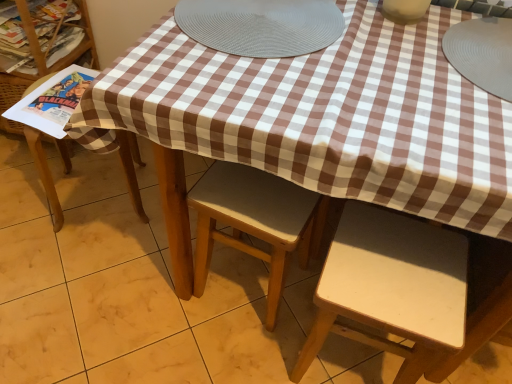
Image resolution: width=512 pixels, height=384 pixels. What do you see at coordinates (53, 101) in the screenshot?
I see `matte paper magazine at left` at bounding box center [53, 101].

In order to click on matte white vase at upper center, which is the 2th tableware from right to left in this screenshot , I will do `click(405, 10)`.

This screenshot has width=512, height=384. Describe the element at coordinates (42, 36) in the screenshot. I see `matte paper book at left` at that location.

Measure the distance between point (64, 23) and camera.

Point (64, 23) and camera are 4.95 feet apart.

This screenshot has width=512, height=384. What do you see at coordinates (402, 293) in the screenshot?
I see `white matte chair at lower right, positioned as the 3th chair in left-to-right order` at bounding box center [402, 293].

Identify the location of white matte chair at lower right, placed as the 1th chair when sorted from right to left. The height and width of the screenshot is (384, 512). (402, 293).

The width and height of the screenshot is (512, 384). Identify the location of matte paper magazine at left. (53, 101).

Is wooden chair at left, which ranks as the 1th chair in left-to-right order, to the left or to the right of gray rubber placemat at upper right, the 1th tableware viewed from the right, in the image?

Based on their positions, wooden chair at left, which ranks as the 1th chair in left-to-right order, is located to the left of gray rubber placemat at upper right, the 1th tableware viewed from the right.

Which is behind, wooden chair at left, which ranks as the 1th chair in left-to-right order, or gray rubber placemat at upper right, the second tableware positioned from the left?

wooden chair at left, which ranks as the 1th chair in left-to-right order.

From a real-world perspective, is wooden chair at left, which ranks as the third chair in right-to-left order, positioned above or below gray rubber placemat at upper right, the 1th tableware viewed from the right?

wooden chair at left, which ranks as the third chair in right-to-left order, is below gray rubber placemat at upper right, the 1th tableware viewed from the right.

Is light brown wood chair at center, which is counted as the 2th chair, starting from the right, far away from gray rubber placemat at upper right, the second tableware positioned from the left?

light brown wood chair at center, which is counted as the 2th chair, starting from the right, is actually quite close to gray rubber placemat at upper right, the second tableware positioned from the left.

Can you confirm if light brown wood chair at center, which appears as the second chair when viewed from the left, is smaller than gray rubber placemat at upper right, the second tableware positioned from the left?

Incorrect, light brown wood chair at center, which appears as the second chair when viewed from the left, is not smaller in size than gray rubber placemat at upper right, the second tableware positioned from the left.

From a real-world perspective, is light brown wood chair at center, which appears as the second chair when viewed from the left, physically located above or below gray rubber placemat at upper right, the 1th tableware viewed from the right?

light brown wood chair at center, which appears as the second chair when viewed from the left, is situated lower than gray rubber placemat at upper right, the 1th tableware viewed from the right, in the real world.

Which is in front, point (226, 202) or point (446, 43)?

Point (446, 43)

Based on the photo, which object is closer to the camera, matte paper book at left or gray textured placemat at center?

Positioned in front is gray textured placemat at center.

The height and width of the screenshot is (384, 512). I want to click on book below the gray textured placemat at center (from a real-world perspective), so click(42, 36).

Who is taller, matte paper book at left or gray textured placemat at center?

matte paper book at left.

Is point (389, 14) positioned behind point (320, 305)?

Yes.

From the picture: From the image's perspective, is matte white vase at upper center, the 1th tableware viewed from the left, on top of white matte chair at lower right, positioned as the 3th chair in left-to-right order?

Indeed, from the image's perspective, matte white vase at upper center, the 1th tableware viewed from the left, is shown above white matte chair at lower right, positioned as the 3th chair in left-to-right order.

From a real-world perspective, which object stands above the other?

matte white vase at upper center, the 1th tableware viewed from the left, from a real-world perspective.

Are matte white vase at upper center, which is the 2th tableware from right to left, and wooden chair at left, which ranks as the 1th chair in left-to-right order, beside each other?

matte white vase at upper center, which is the 2th tableware from right to left, and wooden chair at left, which ranks as the 1th chair in left-to-right order, are clearly separated.

From a real-world perspective, is matte white vase at upper center, the 1th tableware viewed from the left, positioned under wooden chair at left, which ranks as the third chair in right-to-left order, based on gravity?

Incorrect, from a real-world perspective, matte white vase at upper center, the 1th tableware viewed from the left, is higher than wooden chair at left, which ranks as the third chair in right-to-left order.

Is matte white vase at upper center, which is the 2th tableware from right to left, not within wooden chair at left, which ranks as the 1th chair in left-to-right order?

matte white vase at upper center, which is the 2th tableware from right to left, is positioned outside wooden chair at left, which ranks as the 1th chair in left-to-right order.

Considering the sizes of objects matte white vase at upper center, the 1th tableware viewed from the left, and wooden chair at left, which ranks as the third chair in right-to-left order, in the image provided, who is smaller, matte white vase at upper center, the 1th tableware viewed from the left, or wooden chair at left, which ranks as the third chair in right-to-left order,?

With smaller size is matte white vase at upper center, the 1th tableware viewed from the left.

From the image's perspective, which is below, wooden chair at left, which ranks as the 1th chair in left-to-right order, or light brown wood chair at center, which appears as the second chair when viewed from the left?

From the image's view, light brown wood chair at center, which appears as the second chair when viewed from the left, is below.

Could light brown wood chair at center, which is counted as the 2th chair, starting from the right, be considered to be inside wooden chair at left, which ranks as the third chair in right-to-left order?

No.

Does wooden chair at left, which ranks as the 1th chair in left-to-right order, have a greater height compared to light brown wood chair at center, which is counted as the 2th chair, starting from the right?

No.

How far apart are wooden chair at left, which ranks as the third chair in right-to-left order, and light brown wood chair at center, which is counted as the 2th chair, starting from the right?

A distance of 63.51 centimeters exists between wooden chair at left, which ranks as the third chair in right-to-left order, and light brown wood chair at center, which is counted as the 2th chair, starting from the right.

From the image's perspective, between gray textured placemat at center and matte paper magazine at left, which one is located above?

gray textured placemat at center.

I want to click on platter that is above the matte paper magazine at left (from a real-world perspective), so click(261, 25).

Considering the sizes of objects gray textured placemat at center and matte paper magazine at left in the image provided, who is thinner, gray textured placemat at center or matte paper magazine at left?

matte paper magazine at left.

Is matte paper magazine at left at the back of gray textured placemat at center?

No, gray textured placemat at center is not facing the opposite direction of matte paper magazine at left.

Identify the location of chair that is the 3rd object to the left of the gray rubber placemat at upper right, the second tableware positioned from the left, starting at the anchor. This screenshot has height=384, width=512. (45, 175).

Where is `the 2nd chair directly beneath the gray rubber placemat at upper right, the second tableware positioned from the left (from a real-world perspective)`? The image size is (512, 384). the 2nd chair directly beneath the gray rubber placemat at upper right, the second tableware positioned from the left (from a real-world perspective) is located at coordinates (252, 221).

Which object lies further to the anchor point matte white vase at upper center, the 1th tableware viewed from the left, gray textured placemat at center or matte paper book at left?

matte paper book at left is positioned further to the anchor matte white vase at upper center, the 1th tableware viewed from the left.

Looking at the image, which one is located closer to matte paper book at left, gray textured placemat at center or light brown wood chair at center, which appears as the second chair when viewed from the left?

gray textured placemat at center.

Consider the image. Which object lies nearer to the anchor point wooden chair at left, which ranks as the 1th chair in left-to-right order, matte white vase at upper center, which is the 2th tableware from right to left, or gray rubber placemat at upper right, the 1th tableware viewed from the right?

Among the two, matte white vase at upper center, which is the 2th tableware from right to left, is located nearer to wooden chair at left, which ranks as the 1th chair in left-to-right order.

Which object lies further to the anchor point matte paper magazine at left, matte paper book at left or matte white vase at upper center, the 1th tableware viewed from the left?

matte white vase at upper center, the 1th tableware viewed from the left.

Estimate the real-world distances between objects in this image. Which object is closer to gray textured placemat at center, matte paper book at left or wooden chair at left, which ranks as the 1th chair in left-to-right order?

wooden chair at left, which ranks as the 1th chair in left-to-right order, is closer to gray textured placemat at center.

From the image, which object appears to be nearer to matte paper book at left, matte paper magazine at left or light brown wood chair at center, which is counted as the 2th chair, starting from the right?

matte paper magazine at left.

Estimate the real-world distances between objects in this image. Which object is further from gray textured placemat at center, light brown wood chair at center, which appears as the second chair when viewed from the left, or matte paper book at left?

Among the two, matte paper book at left is located further to gray textured placemat at center.

Estimate the real-world distances between objects in this image. Which object is further from wooden chair at left, which ranks as the 1th chair in left-to-right order, light brown wood chair at center, which is counted as the 2th chair, starting from the right, or matte white vase at upper center, the 1th tableware viewed from the left?

matte white vase at upper center, the 1th tableware viewed from the left, lies further to wooden chair at left, which ranks as the 1th chair in left-to-right order, than the other object.

Locate an element on the screen. The width and height of the screenshot is (512, 384). chair between wooden chair at left, which ranks as the 1th chair in left-to-right order, and gray textured placemat at center from left to right is located at coordinates (252, 221).

Locate an element on the screen. platter between matte paper book at left and matte white vase at upper center, the 1th tableware viewed from the left, from left to right is located at coordinates (261, 25).

This screenshot has width=512, height=384. I want to click on platter between matte white vase at upper center, the 1th tableware viewed from the left, and light brown wood chair at center, which appears as the second chair when viewed from the left, in the up-down direction, so tap(261, 25).

The width and height of the screenshot is (512, 384). In order to click on magazine between wooden chair at left, which ranks as the 1th chair in left-to-right order, and gray rubber placemat at upper right, the second tableware positioned from the left, in the horizontal direction in this screenshot , I will do `click(53, 101)`.